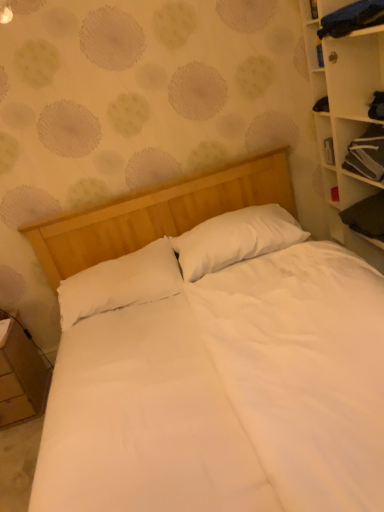
Question: Does wooden nightstand at lower left come in front of white soft pillow at center, arranged as the 2th pillow when viewed from the left?

Choices:
 (A) no
 (B) yes

Answer: (A)

Question: Can you confirm if wooden nightstand at lower left is bigger than white soft pillow at center, arranged as the 2th pillow when viewed from the left?

Choices:
 (A) yes
 (B) no

Answer: (B)

Question: Does wooden nightstand at lower left have a lesser height compared to white soft pillow at center, arranged as the 2th pillow when viewed from the left?

Choices:
 (A) yes
 (B) no

Answer: (B)

Question: From the image's perspective, is wooden nightstand at lower left on white soft pillow at center, marked as the first pillow in a right-to-left arrangement?

Choices:
 (A) no
 (B) yes

Answer: (A)

Question: Does wooden nightstand at lower left appear on the right side of white soft pillow at center, marked as the first pillow in a right-to-left arrangement?

Choices:
 (A) yes
 (B) no

Answer: (B)

Question: Does wooden nightstand at lower left have a greater width compared to white soft pillow at center, arranged as the 2th pillow when viewed from the left?

Choices:
 (A) no
 (B) yes

Answer: (B)

Question: Does white soft pillow at center, placed as the first pillow when sorted from left to right, lie behind white wood bookcase at right?

Choices:
 (A) no
 (B) yes

Answer: (B)

Question: From a real-world perspective, is white soft pillow at center, placed as the first pillow when sorted from left to right, physically below white wood bookcase at right?

Choices:
 (A) yes
 (B) no

Answer: (A)

Question: Does white soft pillow at center, arranged as the 2th pillow when viewed from the right, have a greater width compared to white wood bookcase at right?

Choices:
 (A) yes
 (B) no

Answer: (A)

Question: Is the depth of white soft pillow at center, arranged as the 2th pillow when viewed from the right, less than that of white wood bookcase at right?

Choices:
 (A) no
 (B) yes

Answer: (A)

Question: Would you say white soft pillow at center, arranged as the 2th pillow when viewed from the right, is outside white wood bookcase at right?

Choices:
 (A) yes
 (B) no

Answer: (A)

Question: From a real-world perspective, is white soft pillow at center, placed as the first pillow when sorted from left to right, over white wood bookcase at right?

Choices:
 (A) yes
 (B) no

Answer: (B)

Question: Can you confirm if black fabric cabinet at upper right is smaller than white soft pillow at center, arranged as the 2th pillow when viewed from the right?

Choices:
 (A) yes
 (B) no

Answer: (A)